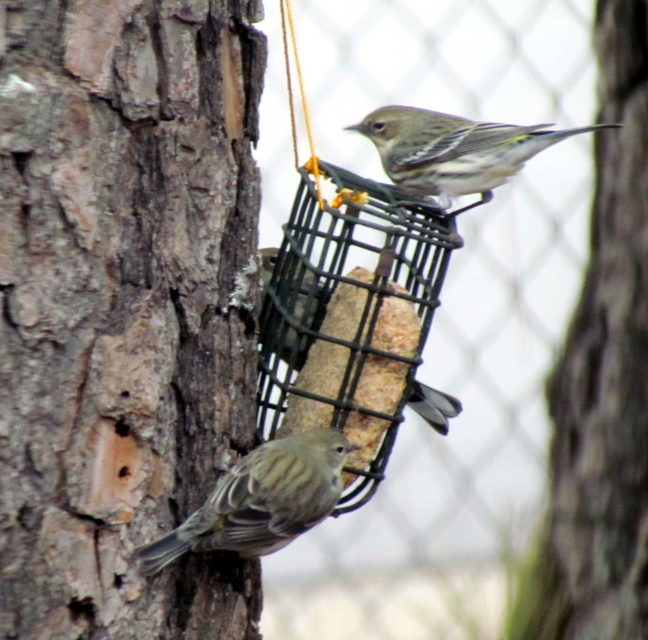
Who is higher up, smooth bark tree trunk at left or brown speckled bird at lower left?

smooth bark tree trunk at left

What do you see at coordinates (124, 307) in the screenshot? I see `smooth bark tree trunk at left` at bounding box center [124, 307].

Find the location of a particular element. This screenshot has width=648, height=640. smooth bark tree trunk at left is located at coordinates (124, 307).

Can you confirm if black wire mesh bird feeder at center is shorter than greenish-yellow feathers at center?

No.

Who is lower down, black wire mesh bird feeder at center or greenish-yellow feathers at center?

black wire mesh bird feeder at center is lower down.

Does point (421, 276) come behind point (353, 125)?

No, (421, 276) is closer to viewer.

The image size is (648, 640). I want to click on black wire mesh bird feeder at center, so click(x=360, y=307).

Which is more to the right, brown speckled bird at lower left or greenish-yellow feathers at center?

greenish-yellow feathers at center

Which is behind, point (305, 456) or point (446, 202)?

Positioned behind is point (446, 202).

Which is in front, point (275, 496) or point (408, 170)?

Positioned in front is point (275, 496).

Locate an element on the screen. This screenshot has height=640, width=648. brown speckled bird at lower left is located at coordinates (260, 500).